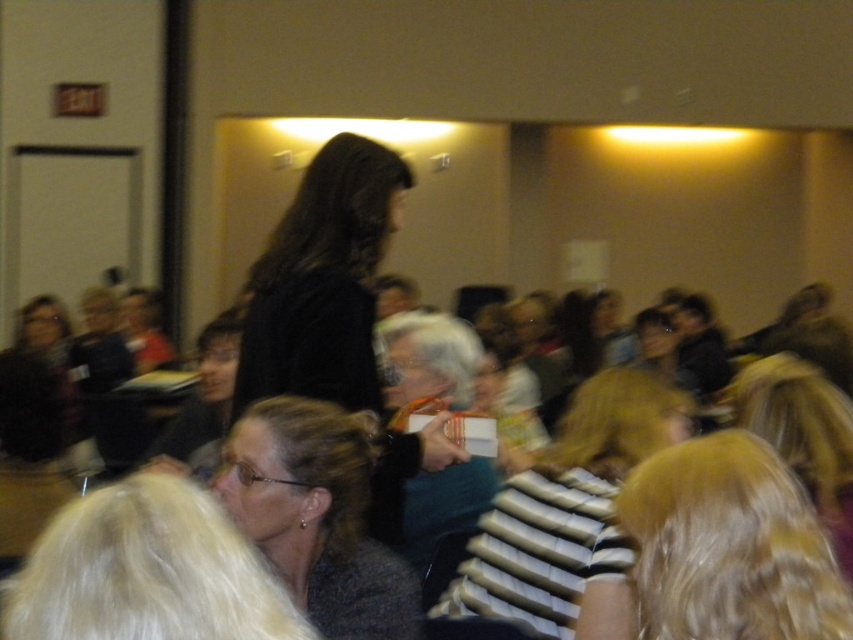
Who is more distant from viewer, (560,513) or (341,532)?

The point (560,513) is more distant.

The image size is (853, 640). What are the coordinates of `striped fabric bag at center` in the screenshot? It's located at (570, 515).